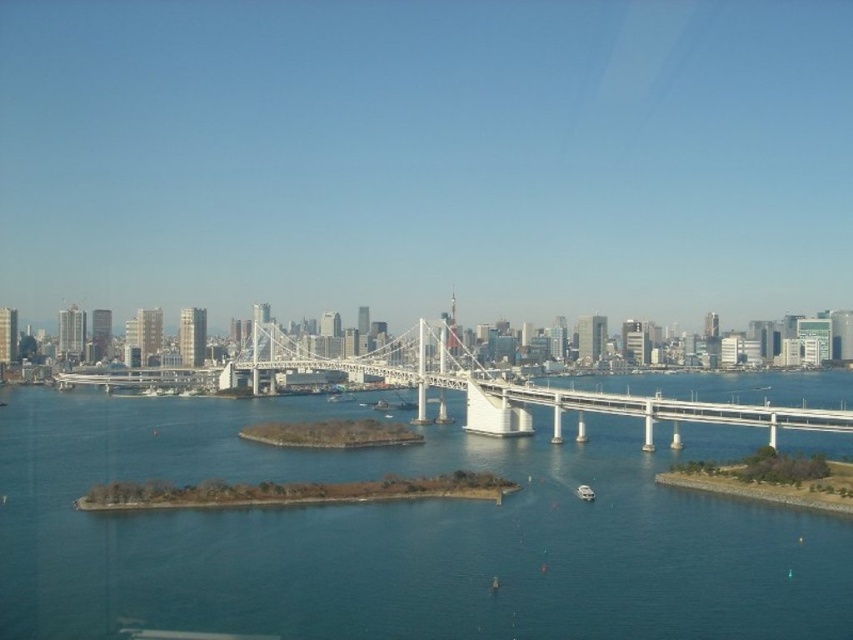
Which is in front, point (558, 612) or point (654, 419)?

Positioned in front is point (558, 612).

Does blue water at center appear under white metallic bridge at center?

Yes, blue water at center is below white metallic bridge at center.

Find the location of a particular element. blue water at center is located at coordinates (397, 534).

Locate an element on the screen. The height and width of the screenshot is (640, 853). blue water at center is located at coordinates (397, 534).